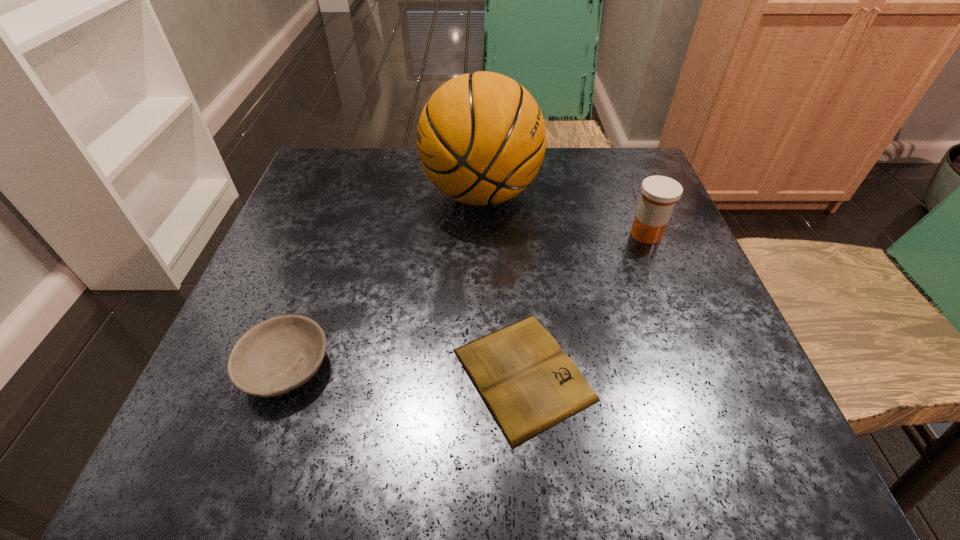
Locate an element on the screen. The height and width of the screenshot is (540, 960). vacant space that's between the basketball and the shortest object is located at coordinates pyautogui.click(x=502, y=284).

Where is `vacant area between the book and the third shortest object`? This screenshot has height=540, width=960. vacant area between the book and the third shortest object is located at coordinates (585, 304).

Image resolution: width=960 pixels, height=540 pixels. I want to click on free spot between the second shortest object and the basketball, so click(384, 281).

Locate an element on the screen. free space between the third tallest object and the medicine is located at coordinates (467, 301).

Find the location of a particular element. The height and width of the screenshot is (540, 960). vacant area between the shortest object and the tallest object is located at coordinates coord(502,284).

Locate an element on the screen. The height and width of the screenshot is (540, 960). free space between the rightmost object and the shortest object is located at coordinates (585, 304).

The height and width of the screenshot is (540, 960). In order to click on blank region between the book and the bowl in this screenshot , I will do `click(405, 371)`.

Select which object appears as the second closest to the basketball. Please provide its 2D coordinates. Your answer should be formatted as a tuple, i.e. [(x, y)], where the tuple contains the x and y coordinates of a point satisfying the conditions above.

[(529, 385)]

The height and width of the screenshot is (540, 960). I want to click on the closest object to the medicine, so click(481, 138).

The width and height of the screenshot is (960, 540). What are the coordinates of `vacant area that satisfies the following two spatial constraints: 1. on the surface of the tallest object near the brand logo; 2. on the left side of the book` in the screenshot? It's located at (482, 374).